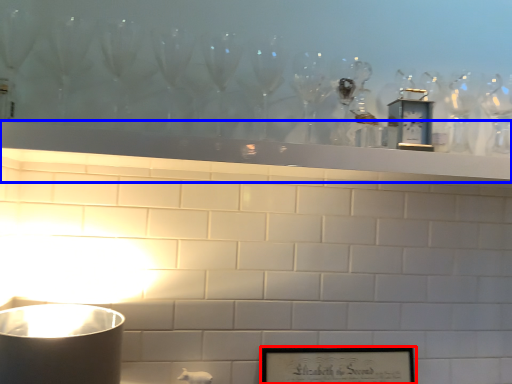
Question: Which object is closer to the camera taking this photo, picture frame (highlighted by a red box) or mantle (highlighted by a blue box)?

Choices:
 (A) picture frame
 (B) mantle

Answer: (B)